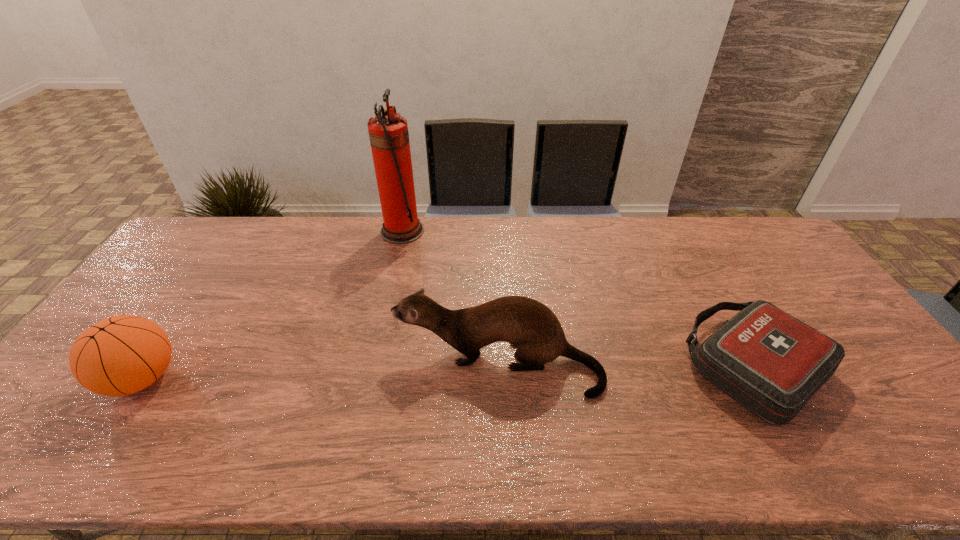
Locate an element on the screen. This screenshot has height=540, width=960. vacant area that lies between the ferret and the leftmost object is located at coordinates (320, 372).

Locate an element on the screen. vacant area that lies between the fire extinguisher and the ferret is located at coordinates (450, 298).

Locate an element on the screen. This screenshot has width=960, height=540. object that ranks as the second closest to the leftmost object is located at coordinates (388, 133).

At what (x,y) coordinates should I click in order to perform the action: click on object that stands as the second closest to the shortest object. Please return your answer as a coordinate pair (x, y). Looking at the image, I should click on (388, 133).

You are a GUI agent. You are given a task and a screenshot of the screen. Output one action in this format:
    pyautogui.click(x=<x>, y=<y>)
    Task: Click on the vacant region that satisfies the following two spatial constraints: 1. at the face of the shortest object; 2. on the right side of the ferret
    The image size is (960, 540).
    Given the screenshot: What is the action you would take?
    pyautogui.click(x=498, y=367)

I want to click on free space that satisfies the following two spatial constraints: 1. at the face of the shortest object; 2. on the right side of the ferret, so click(498, 367).